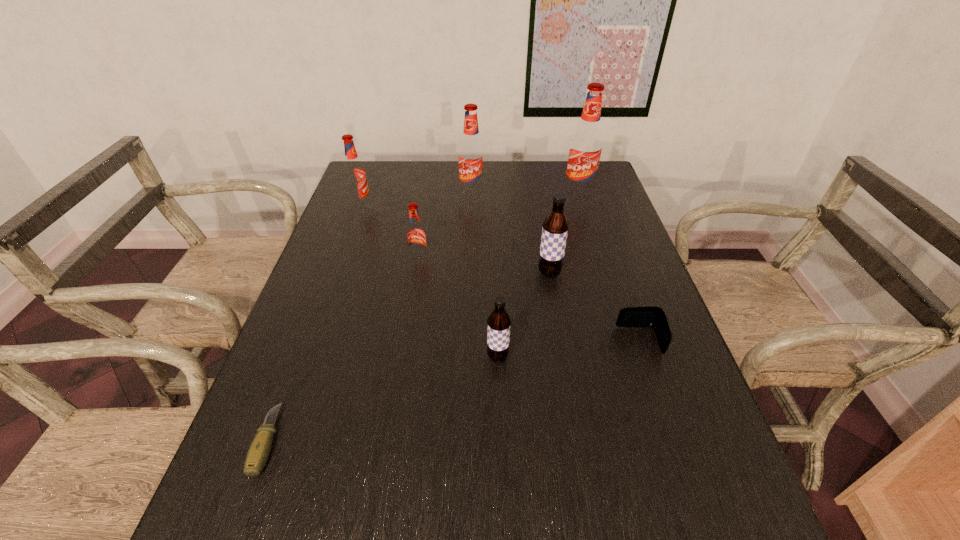
At what (x,y) coordinates should I click in order to perform the action: click on vacant space at the far edge of the desktop. Please return your answer as a coordinate pair (x, y). This screenshot has width=960, height=540. Looking at the image, I should click on (441, 165).

Locate an element on the screen. vacant space at the left edge of the desktop is located at coordinates (380, 210).

This screenshot has height=540, width=960. What are the coordinates of `free space at the right edge of the desktop` in the screenshot? It's located at 657,454.

The image size is (960, 540). I want to click on vacant area at the far right corner of the desktop, so click(x=605, y=185).

The height and width of the screenshot is (540, 960). Find the location of `vacant space that's between the rightmost root beer and the leftmost root beer`. vacant space that's between the rightmost root beer and the leftmost root beer is located at coordinates (469, 200).

Where is `vacant space in between the wallet and the smallest red root beer`? The image size is (960, 540). vacant space in between the wallet and the smallest red root beer is located at coordinates (529, 300).

The image size is (960, 540). Identify the location of unoccupied area between the fifth object from left to right and the farther brown root beer. (523, 315).

Where is `free spot between the leftmost red root beer and the nearest object`? The height and width of the screenshot is (540, 960). free spot between the leftmost red root beer and the nearest object is located at coordinates (314, 323).

Find the location of a particular element. free spot between the farther brown root beer and the second shortest object is located at coordinates (594, 307).

This screenshot has height=540, width=960. In order to click on free space between the rightmost red root beer and the seventh tallest object in this screenshot , I will do `click(609, 267)`.